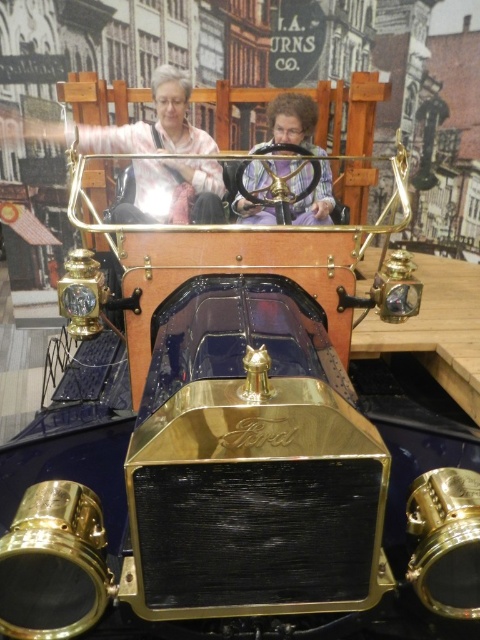
Question: Is matte pink sweater at upper center further to the viewer compared to purple fabric at center?

Choices:
 (A) yes
 (B) no

Answer: (A)

Question: Which point is closer to the camera taking this photo?

Choices:
 (A) (236, 205)
 (B) (113, 128)

Answer: (A)

Question: Which point is farther to the camera?

Choices:
 (A) (204, 195)
 (B) (249, 166)

Answer: (B)

Question: Considering the relative positions of matte pink sweater at upper center and purple fabric at center in the image provided, where is matte pink sweater at upper center located with respect to purple fabric at center?

Choices:
 (A) below
 (B) above

Answer: (B)

Question: Which of the following is the closest to the observer?

Choices:
 (A) (315, 205)
 (B) (184, 186)

Answer: (A)

Question: From the image, what is the correct spatial relationship of matte pink sweater at upper center in relation to purple fabric at center?

Choices:
 (A) above
 (B) below

Answer: (A)